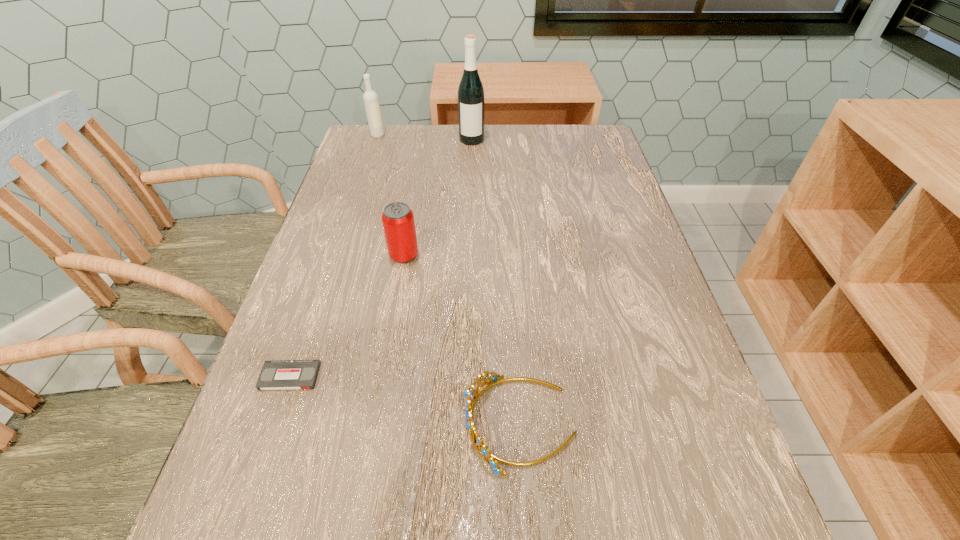
Where is `vacant space located on the front-facing side of the second shortest object`? This screenshot has width=960, height=540. vacant space located on the front-facing side of the second shortest object is located at coordinates (386, 423).

Where is `free space located on the front-facing side of the second shortest object`? The image size is (960, 540). free space located on the front-facing side of the second shortest object is located at coordinates (362, 423).

This screenshot has width=960, height=540. I want to click on vacant space located 0.370m on the right of the videotape, so click(525, 376).

Locate an element on the screen. The width and height of the screenshot is (960, 540). wine bottle at the far edge is located at coordinates (471, 94).

I want to click on vodka that is at the far edge, so click(x=370, y=97).

This screenshot has width=960, height=540. Find the location of `vodka located in the left edge section of the desktop`. vodka located in the left edge section of the desktop is located at coordinates (370, 97).

Where is `videotape that is at the left edge`? videotape that is at the left edge is located at coordinates coord(281,374).

The width and height of the screenshot is (960, 540). Find the location of `object at the far left corner`. object at the far left corner is located at coordinates (370, 97).

In the image, there is a desktop. Identify the location of free region at the far edge. (512, 131).

Locate an element on the screen. The image size is (960, 540). free space at the left edge of the desktop is located at coordinates (369, 194).